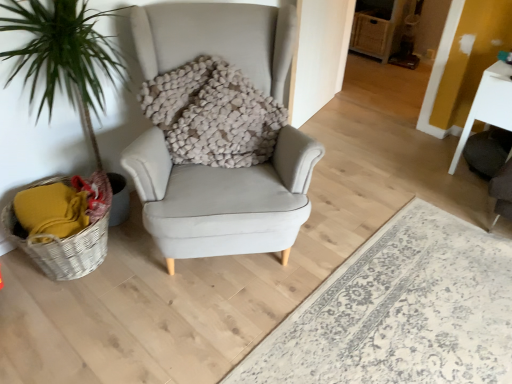
Identify the location of free space to the right of woven wicker basket at lower left. The image size is (512, 384). (156, 280).